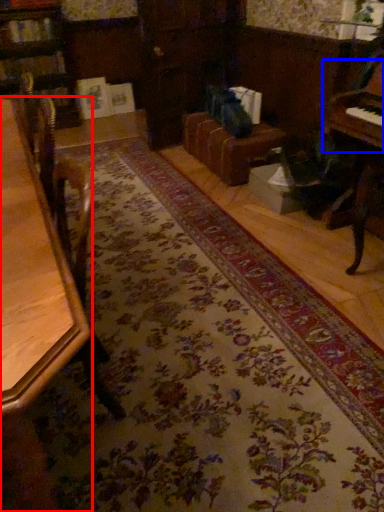
Question: Among these objects, which one is nearest to the camera, table (highlighted by a red box) or piano (highlighted by a blue box)?

Choices:
 (A) table
 (B) piano

Answer: (A)